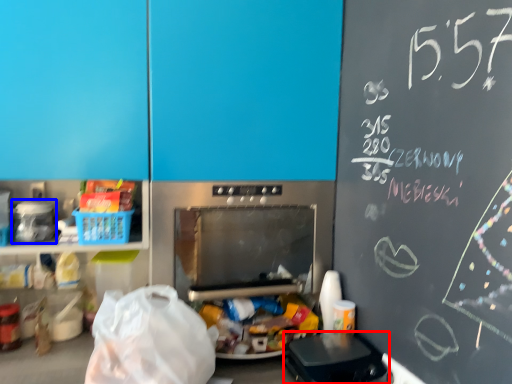
Question: Which object is further to the camera taking this photo, appliance (highlighted by a red box) or appliance (highlighted by a blue box)?

Choices:
 (A) appliance
 (B) appliance

Answer: (B)